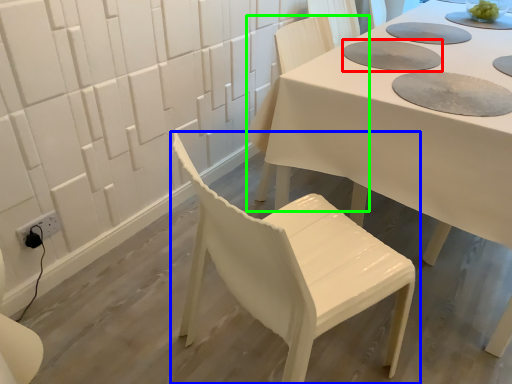
Question: Based on their relative distances, which object is nearer to paper plate (highlighted by a red box)? Choose from chair (highlighted by a blue box) and chair (highlighted by a green box).

Choices:
 (A) chair
 (B) chair

Answer: (B)